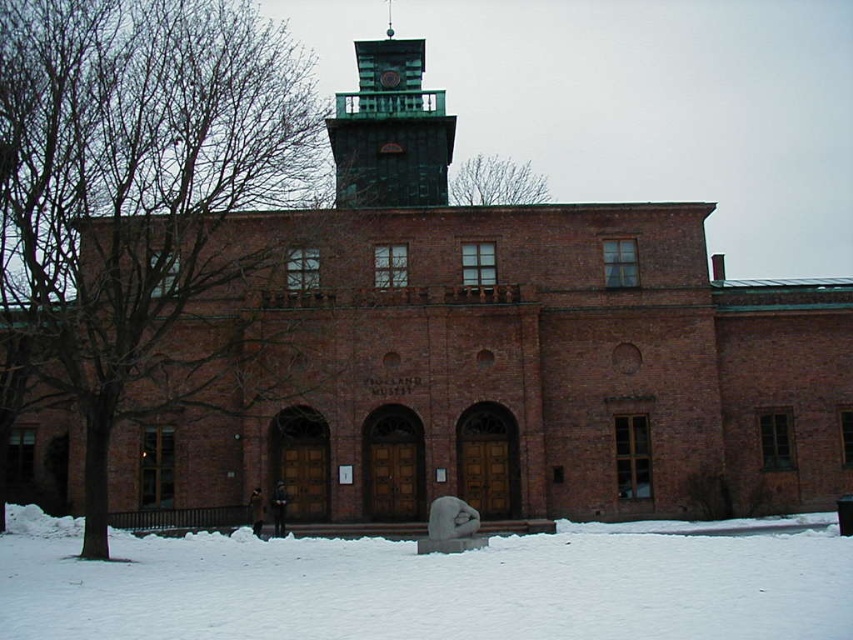
Who is shorter, white powdery snow at lower center or bare branches at upper center?

With less height is white powdery snow at lower center.

Who is more distant from viewer, [340,556] or [477,189]?

Point [477,189]

Measure the distance between point (112, 608) and camera.

163.14 feet

Locate an element on the screen. This screenshot has height=640, width=853. white powdery snow at lower center is located at coordinates (424, 588).

Between point (155, 44) and point (49, 518), which one is positioned in front?

Point (49, 518)

Who is more forward, (x=22, y=296) or (x=55, y=548)?

Point (x=55, y=548)

Locate an element on the screen. The image size is (853, 640). brown bark tree at left is located at coordinates (144, 208).

You are a GUI agent. You are given a task and a screenshot of the screen. Output one action in this format:
    pyautogui.click(x=<x>, y=<y>)
    Task: Click on the green patina metal clock tower at upper center
    The width and height of the screenshot is (853, 640).
    Given the screenshot: What is the action you would take?
    pyautogui.click(x=390, y=129)

Is the position of green patina metal clock tower at upper center less distant than that of bare branches at upper center?

Yes, it is in front of bare branches at upper center.

Which is behind, point (351, 198) or point (500, 173)?

The point (500, 173) is behind.

Identify the location of green patina metal clock tower at upper center. (390, 129).